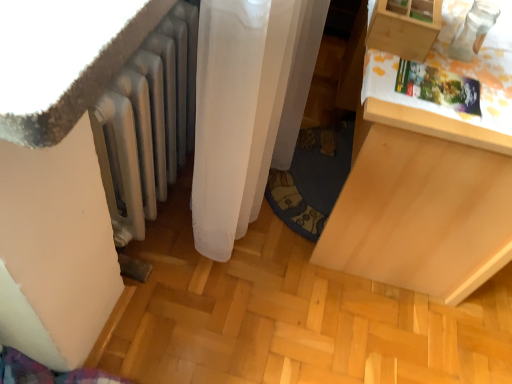
Image resolution: width=512 pixels, height=384 pixels. What do you see at coordinates (429, 175) in the screenshot?
I see `light wood drawer at right` at bounding box center [429, 175].

Measure the distance between point (x=404, y=17) and camera.

Point (x=404, y=17) and camera are 3.42 feet apart from each other.

Where is `light wood drawer at right`? The image size is (512, 384). light wood drawer at right is located at coordinates (429, 175).

Would you say wooden drawer at upper right is inside or outside light wood drawer at right?

wooden drawer at upper right is outside light wood drawer at right.

Does point (371, 47) lie in front of point (325, 244)?

Yes.

Considering the positions of objects wooden drawer at upper right and light wood drawer at right in the image provided, who is in front, wooden drawer at upper right or light wood drawer at right?

light wood drawer at right.

Looking at their sizes, would you say light wood drawer at right is wider or thinner than wooden drawer at upper right?

Considering their sizes, light wood drawer at right looks broader than wooden drawer at upper right.

Is light wood drawer at right directly adjacent to wooden drawer at upper right?

There is a gap between light wood drawer at right and wooden drawer at upper right.

Is light wood drawer at right turned away from wooden drawer at upper right?

No, light wood drawer at right's orientation is not away from wooden drawer at upper right.

Considering the relative sizes of silver metallic radiator at lower left and wooden drawer at upper right in the image provided, is silver metallic radiator at lower left bigger than wooden drawer at upper right?

Yes, silver metallic radiator at lower left is bigger than wooden drawer at upper right.

Is silver metallic radiator at lower left positioned far away from wooden drawer at upper right?

No, there isn't a large distance between silver metallic radiator at lower left and wooden drawer at upper right.

From a real-world perspective, is silver metallic radiator at lower left under wooden drawer at upper right?

Yes, from a real-world perspective, silver metallic radiator at lower left is under wooden drawer at upper right.

Is wooden drawer at upper right located outside silver metallic radiator at lower left?

Yes.

Based on the photo, visually, is wooden drawer at upper right positioned to the left or to the right of silver metallic radiator at lower left?

wooden drawer at upper right is to the right of silver metallic radiator at lower left.

The image size is (512, 384). In the image, there is a wooden drawer at upper right. Find the location of `radiator below it (from the image's perspective)`. radiator below it (from the image's perspective) is located at coordinates (148, 122).

Is wooden drawer at upper right aimed at silver metallic radiator at lower left?

No, wooden drawer at upper right is not aimed at silver metallic radiator at lower left.

Is silver metallic radiator at lower left turned away from light wood drawer at right?

Yes, silver metallic radiator at lower left's orientation is away from light wood drawer at right.

Is silver metallic radiator at lower left with light wood drawer at right?

They are not placed beside each other.

In terms of height, does silver metallic radiator at lower left look taller or shorter compared to light wood drawer at right?

silver metallic radiator at lower left is shorter than light wood drawer at right.

Measure the distance between silver metallic radiator at lower left and light wood drawer at right.

25.66 inches.

Looking at this image, is light wood drawer at right in front of or behind silver metallic radiator at lower left in the image?

light wood drawer at right is positioned farther from the viewer than silver metallic radiator at lower left.

Is light wood drawer at right surrounding silver metallic radiator at lower left?

No, silver metallic radiator at lower left is located outside of light wood drawer at right.

How many degrees apart are the facing directions of light wood drawer at right and silver metallic radiator at lower left?

2.86 degrees.

Are light wood drawer at right and silver metallic radiator at lower left located far from each other?

light wood drawer at right is actually quite close to silver metallic radiator at lower left.

Find the location of a particular element. Image resolution: width=512 pixels, height=384 pixels. furniture located below the wooden drawer at upper right (from the image's perspective) is located at coordinates click(429, 175).

Find the location of a particular element. furniture below the wooden drawer at upper right (from a real-world perspective) is located at coordinates (429, 175).

Estimate the real-world distances between objects in this image. Which object is further from light wood drawer at right, silver metallic radiator at lower left or wooden drawer at upper right?

silver metallic radiator at lower left.

Based on their spatial positions, is wooden drawer at upper right or light wood drawer at right closer to silver metallic radiator at lower left?

wooden drawer at upper right is positioned closer to the anchor silver metallic radiator at lower left.

From the image, which object appears to be nearer to wooden drawer at upper right, light wood drawer at right or silver metallic radiator at lower left?

Based on the image, light wood drawer at right appears to be nearer to wooden drawer at upper right.

Estimate the real-world distances between objects in this image. Which object is closer to wooden drawer at upper right, silver metallic radiator at lower left or light wood drawer at right?

light wood drawer at right.

Estimate the real-world distances between objects in this image. Which object is further from light wood drawer at right, wooden drawer at upper right or silver metallic radiator at lower left?

silver metallic radiator at lower left is positioned further to the anchor light wood drawer at right.

Looking at the image, which one is located further to silver metallic radiator at lower left, light wood drawer at right or wooden drawer at upper right?

light wood drawer at right is positioned further to the anchor silver metallic radiator at lower left.

You are a GUI agent. You are given a task and a screenshot of the screen. Output one action in this format:
    pyautogui.click(x=<x>, y=<y>)
    Task: Click on the drawer between silver metallic radiator at lower left and light wood drawer at right
    The image size is (512, 384).
    Given the screenshot: What is the action you would take?
    pyautogui.click(x=401, y=33)